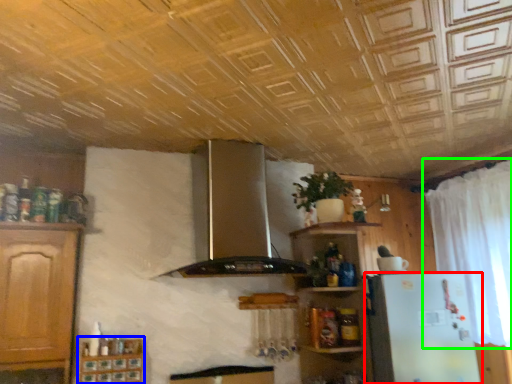
Question: Estimate the real-world distances between objects in this image. Which object is farther from refrigerator (highlighted by a red box), cabinetry (highlighted by a blue box) or curtain (highlighted by a green box)?

Choices:
 (A) cabinetry
 (B) curtain

Answer: (A)